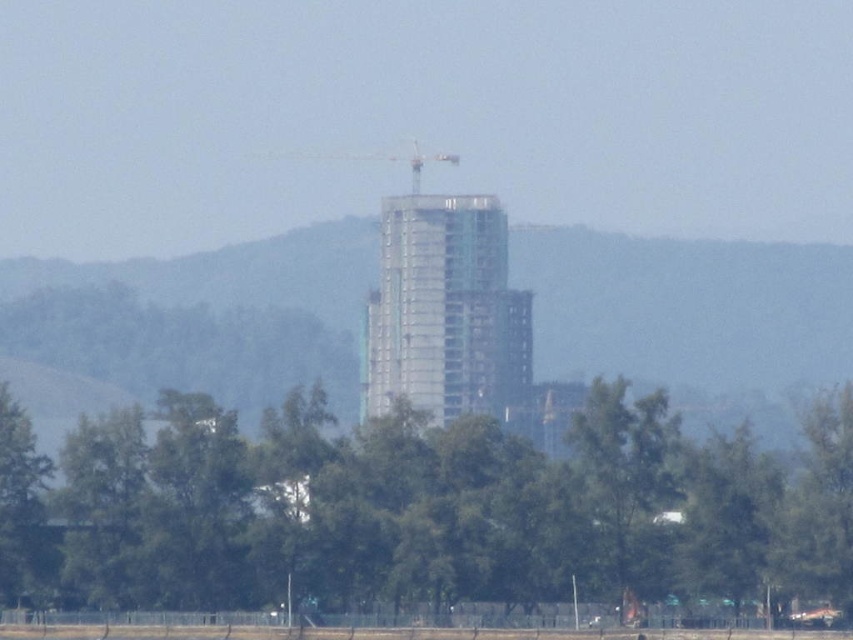
You are a construction worker who needs to assess the visibility of the metallic gray crane at center from the green leafy tree at lower center. Based on the scene, which object is nearer to you, and how might this affect your ability to see the crane clearly?

The green leafy tree at lower center is closer to the viewer than the metallic gray crane at center. Since the tree is in front of the crane, it may partially obstruct your view of the crane, making it less visible depending on the tree density.

You are a construction worker standing at the crane at the top of the building. You need to place a new beam at the point marked as point (312, 486). The beam is 400 meters long. Can you safely place the beam from your current position to the point?

The point (312, 486) is 430.20 meters from the camera. Since the beam is only 400 meters long, it is 30.20 meters shorter than the required distance. Therefore, the beam cannot reach the point from the crane at the top of the building.

You are a construction worker standing at the base of the metallic gray crane at center. You need to move to the green leafy tree at lower center for a safety inspection. Which direction should you walk to reach the tree?

The green leafy tree at lower center is positioned under the metallic gray crane at center, so you should walk downward from the crane to reach the tree.